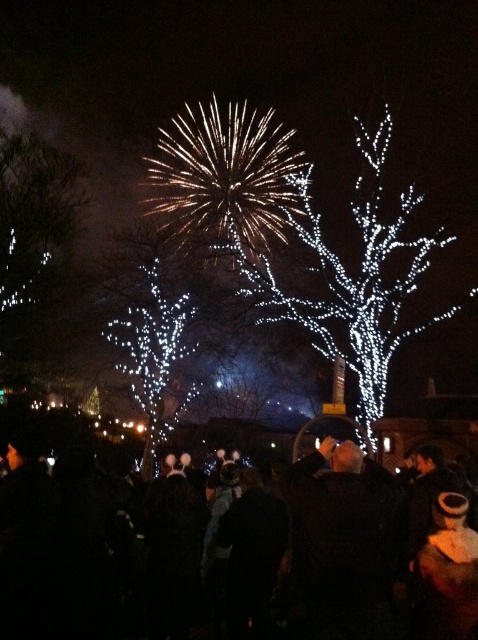
You are standing at the origin point of the image coordinate system. The camera is pointing towards the center of the scene where fireworks are displayed. If you want to walk towards the black fabric crowd at center, which direction should you move in terms of x and y coordinates?

To reach the black fabric crowd at center located at point 0.863 in x and 0.094 in y coordinates, you should move in the positive x direction and slightly positive y direction from the origin.

You are a photographer trying to capture the fireworks display in the distance. You notice the black fabric crowd at center and the illuminated white tree at center in your shot. Which object should you focus on to ensure the fireworks are in the background?

The black fabric crowd at center is shorter than the illuminated white tree at center, so focusing on the illuminated white tree at center will ensure the fireworks in the background are properly captured.